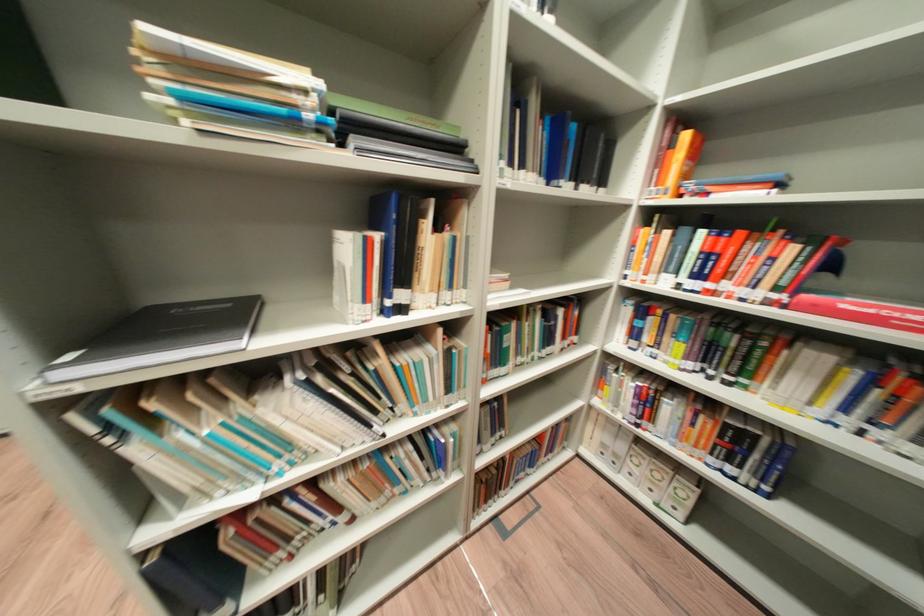
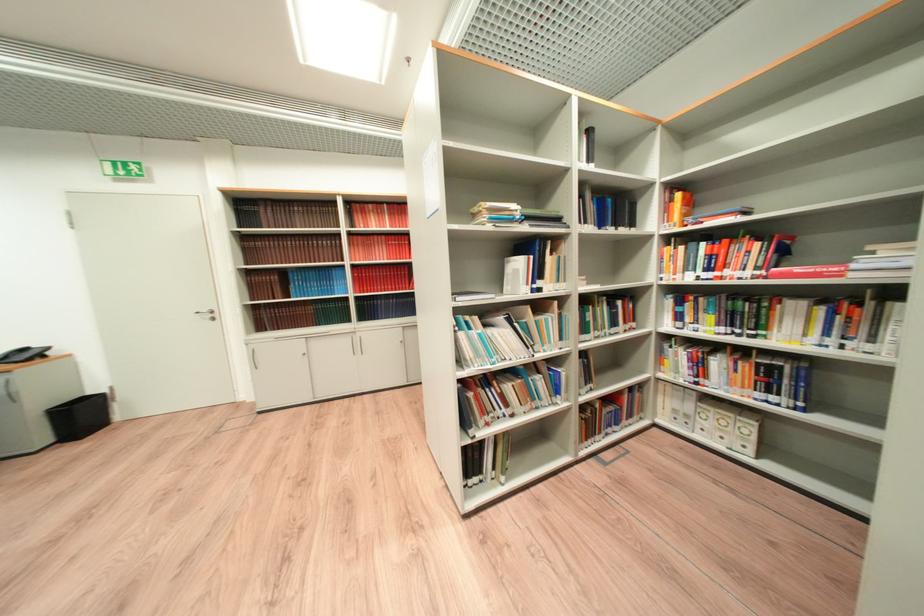
Question: The images are taken continuously from a first-person perspective. In which direction is your viewpoint rotating?

Choices:
 (A) Left
 (B) Right
 (C) Up
 (D) Down

Answer: (C)